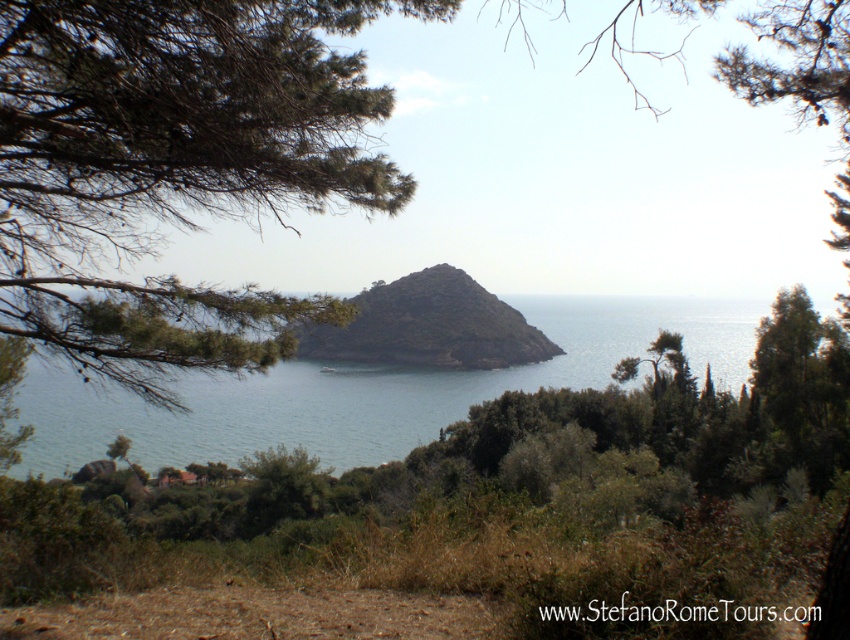
Between greenish-blue water at center and brown rocky hillside at center, which one has less height?

With less height is brown rocky hillside at center.

How distant is greenish-blue water at center from brown rocky hillside at center?

greenish-blue water at center and brown rocky hillside at center are 35.56 feet apart.

You are a GUI agent. You are given a task and a screenshot of the screen. Output one action in this format:
    pyautogui.click(x=<x>, y=<y>)
    Task: Click on the greenish-blue water at center
    Image resolution: width=850 pixels, height=640 pixels.
    Given the screenshot: What is the action you would take?
    pyautogui.click(x=367, y=390)

Which is below, brown rocky hillside at center or green leafy tree at center-right?

green leafy tree at center-right is lower down.

Is point (463, 365) farther from viewer compared to point (652, 381)?

Yes, point (463, 365) is behind point (652, 381).

Find the location of a particular element. brown rocky hillside at center is located at coordinates (429, 324).

Between green leafy tree at center and green leafy tree at center-right, which one is positioned lower?

green leafy tree at center-right is lower down.

Does point (279, 214) come farther from viewer compared to point (658, 355)?

That is False.

Find the location of a particular element. The height and width of the screenshot is (640, 850). green leafy tree at center is located at coordinates (174, 168).